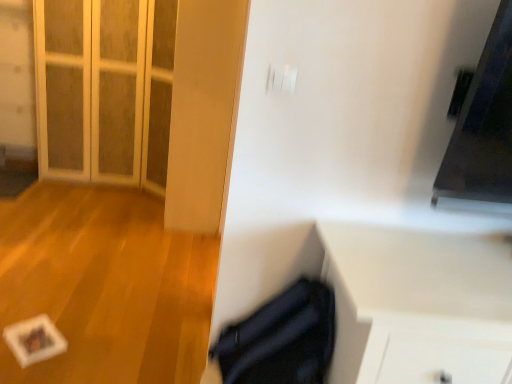
Question: Is white matte cabinet at lower right at the left side of white matte paper at lower left?

Choices:
 (A) yes
 (B) no

Answer: (B)

Question: From the image's perspective, is white matte cabinet at lower right above white matte paper at lower left?

Choices:
 (A) yes
 (B) no

Answer: (B)

Question: Is white matte paper at lower left located within white matte cabinet at lower right?

Choices:
 (A) yes
 (B) no

Answer: (B)

Question: From a real-world perspective, is white matte cabinet at lower right under white matte paper at lower left?

Choices:
 (A) no
 (B) yes

Answer: (A)

Question: Does white matte cabinet at lower right turn towards white matte paper at lower left?

Choices:
 (A) no
 (B) yes

Answer: (A)

Question: Considering their positions, is white matte paper at lower left located in front of or behind white matte cabinet at lower right?

Choices:
 (A) front
 (B) behind

Answer: (B)

Question: From a real-world perspective, relative to white matte cabinet at lower right, is white matte paper at lower left vertically above or below?

Choices:
 (A) above
 (B) below

Answer: (B)

Question: Is white matte paper at lower left inside or outside of white matte cabinet at lower right?

Choices:
 (A) outside
 (B) inside

Answer: (A)

Question: From the image's perspective, is white matte paper at lower left located above or below white matte cabinet at lower right?

Choices:
 (A) below
 (B) above

Answer: (B)

Question: Is white glass door at upper left wider or thinner than white matte cabinet at lower right?

Choices:
 (A) wide
 (B) thin

Answer: (A)

Question: Is point (57, 24) closer or farther from the camera than point (444, 258)?

Choices:
 (A) closer
 (B) farther

Answer: (B)

Question: Do you think white glass door at upper left is within white matte cabinet at lower right, or outside of it?

Choices:
 (A) outside
 (B) inside

Answer: (A)

Question: Looking at the image, does white glass door at upper left seem bigger or smaller compared to white matte cabinet at lower right?

Choices:
 (A) big
 (B) small

Answer: (A)

Question: Looking at their shapes, would you say white matte cabinet at lower right is wider or thinner than white matte paper at lower left?

Choices:
 (A) thin
 (B) wide

Answer: (A)

Question: Is white matte cabinet at lower right spatially inside white matte paper at lower left, or outside of it?

Choices:
 (A) inside
 (B) outside

Answer: (B)